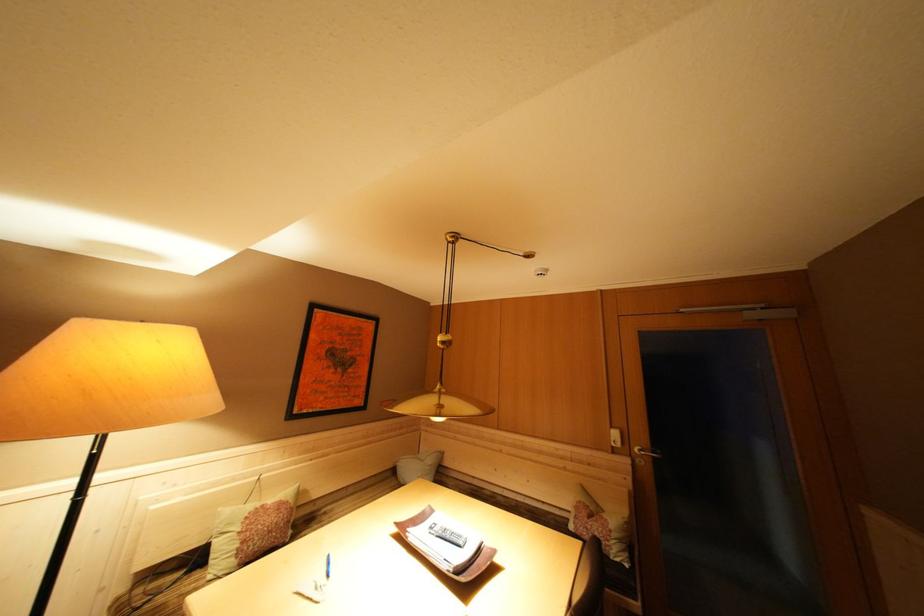
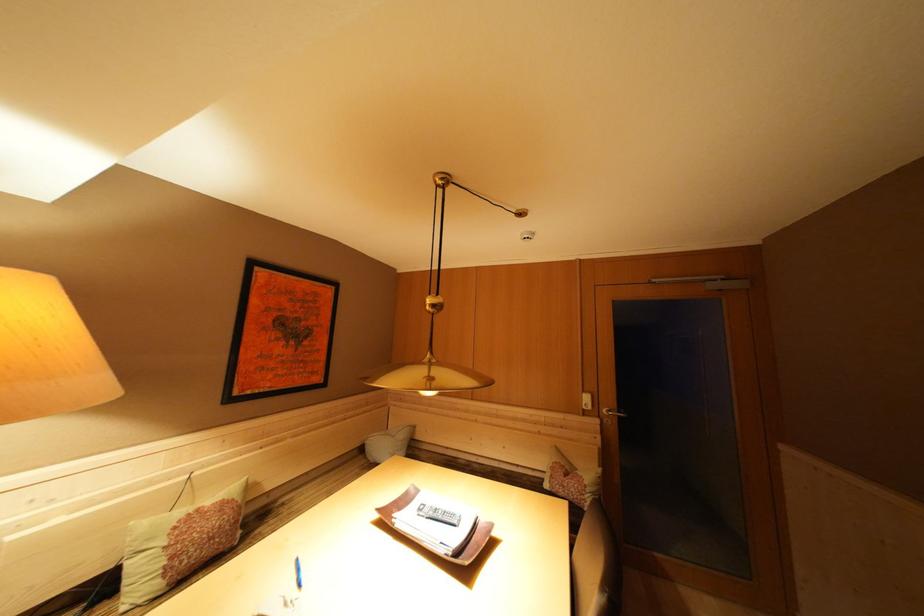
Locate, in the second image, the point that corresponds to point 438,533 in the first image.

(427, 515)